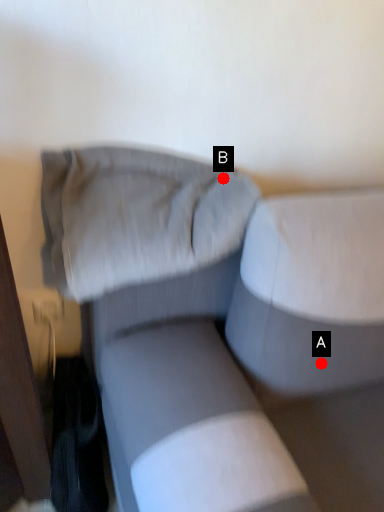
Question: Two points are circled on the image, labeled by A and B beside each circle. Which point is closer to the camera taking this photo?

Choices:
 (A) A is closer
 (B) B is closer

Answer: (B)